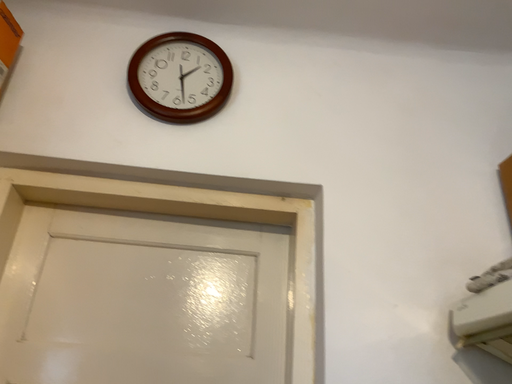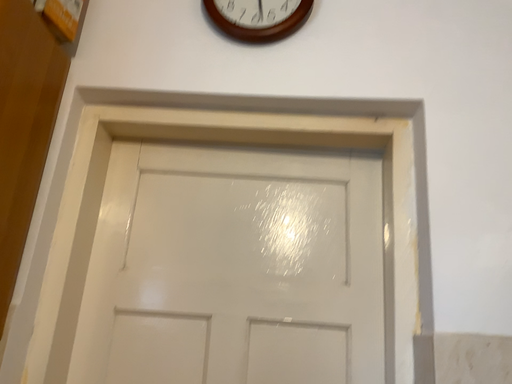
Question: Which way did the camera rotate in the video?

Choices:
 (A) rotated left
 (B) rotated right

Answer: (A)